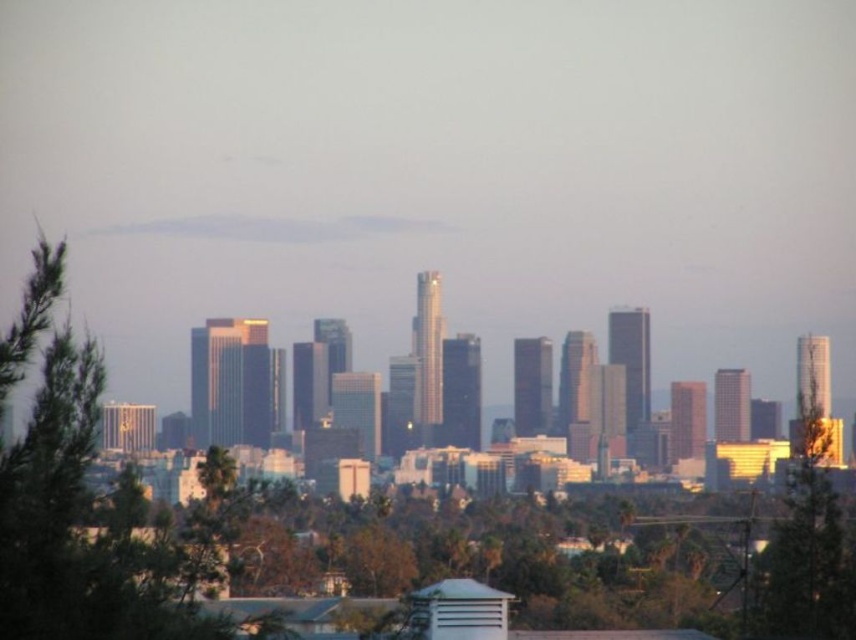
You are standing in the city park and see the green leafy tree at left and the green leafy tree at right. Which tree is closer to you?

The green leafy tree at left is closer to you because it is positioned over the green leafy tree at right, indicating it is in front.

You are standing at the center of the cityscape and want to take a photo of the green leafy tree at left without any obstructions. Is the tree visible from your current position?

The green leafy tree at left is located at point (76,525), which means it is positioned to the left side of the scene. Since you are standing at the center, the tree should be visible to your left without obstructions from other objects mentioned in the scene.